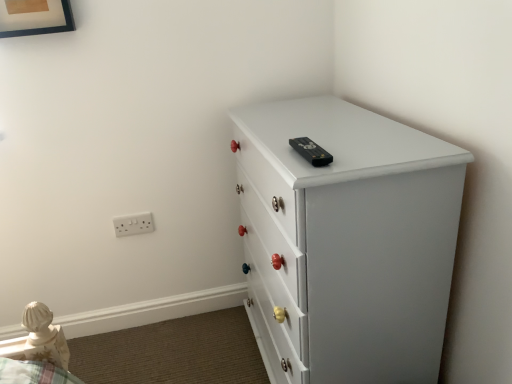
Question: Is white plastic electric outlet at lower left to the right of white painted wood chest of drawers at upper right from the viewer's perspective?

Choices:
 (A) no
 (B) yes

Answer: (A)

Question: Is white painted wood chest of drawers at upper right at the back of white plastic electric outlet at lower left?

Choices:
 (A) yes
 (B) no

Answer: (B)

Question: Does white plastic electric outlet at lower left have a lesser height compared to white painted wood chest of drawers at upper right?

Choices:
 (A) yes
 (B) no

Answer: (A)

Question: Does white plastic electric outlet at lower left lie in front of white painted wood chest of drawers at upper right?

Choices:
 (A) yes
 (B) no

Answer: (B)

Question: From the image's perspective, is white plastic electric outlet at lower left on top of white painted wood chest of drawers at upper right?

Choices:
 (A) yes
 (B) no

Answer: (A)

Question: Would you say white painted wood chest of drawers at upper right is to the left or to the right of white plastic electric outlet at lower left in the picture?

Choices:
 (A) right
 (B) left

Answer: (A)

Question: In the image, is white painted wood chest of drawers at upper right positioned in front of or behind white plastic electric outlet at lower left?

Choices:
 (A) behind
 (B) front

Answer: (B)

Question: From a real-world perspective, is white painted wood chest of drawers at upper right above or below white plastic electric outlet at lower left?

Choices:
 (A) above
 (B) below

Answer: (B)

Question: In terms of height, does white painted wood chest of drawers at upper right look taller or shorter compared to white plastic electric outlet at lower left?

Choices:
 (A) short
 (B) tall

Answer: (B)

Question: Looking at the image, does wooden picture frame at upper left seem bigger or smaller compared to white painted wood chest of drawers at upper right?

Choices:
 (A) small
 (B) big

Answer: (A)

Question: Relative to white painted wood chest of drawers at upper right, is wooden picture frame at upper left in front or behind?

Choices:
 (A) behind
 (B) front

Answer: (A)

Question: Choose the correct answer: Is wooden picture frame at upper left inside white painted wood chest of drawers at upper right or outside it?

Choices:
 (A) inside
 (B) outside

Answer: (B)

Question: Looking at their shapes, would you say wooden picture frame at upper left is wider or thinner than white painted wood chest of drawers at upper right?

Choices:
 (A) thin
 (B) wide

Answer: (A)

Question: Would you say white painted wood chest of drawers at upper right is inside or outside wooden picture frame at upper left?

Choices:
 (A) outside
 (B) inside

Answer: (A)

Question: Based on their sizes in the image, would you say white painted wood chest of drawers at upper right is bigger or smaller than wooden picture frame at upper left?

Choices:
 (A) small
 (B) big

Answer: (B)